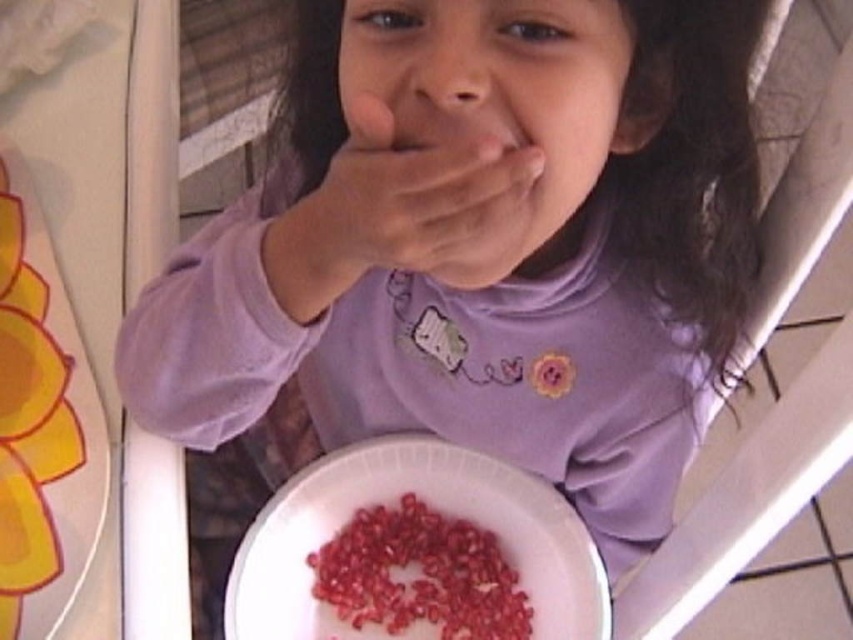
You are standing 36 inches away from the point at coordinates point [317,461]. Can you reach it without moving your feet?

The distance of point [317,461] from viewer is 30.09 inches. Since you are standing 36 inches away, you are 5.91 inches too far to reach it without moving your feet.

The child is trying to pick up the pomegranate seeds. Which group of pomegranate seeds is wider, the pomegranate seeds at center or the red glossy pomegranate seeds at lower center?

The pomegranate seeds at center is wider than the red glossy pomegranate seeds at lower center.

The child is sitting in a high chair with a white paper plate. There is a point marked at coordinates (428, 502). What is located at that point?

The point at coordinates (428, 502) marks the pomegranate seeds at center.